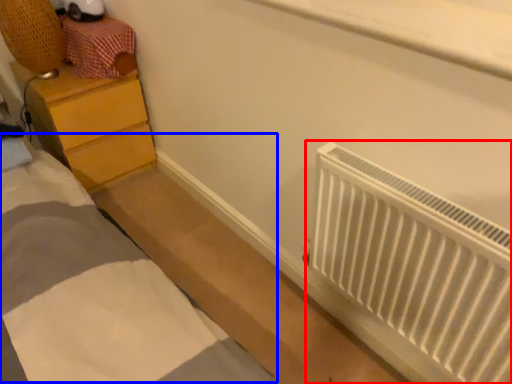
Question: Which object is closer to the camera taking this photo, radiator (highlighted by a red box) or bed (highlighted by a blue box)?

Choices:
 (A) radiator
 (B) bed

Answer: (A)